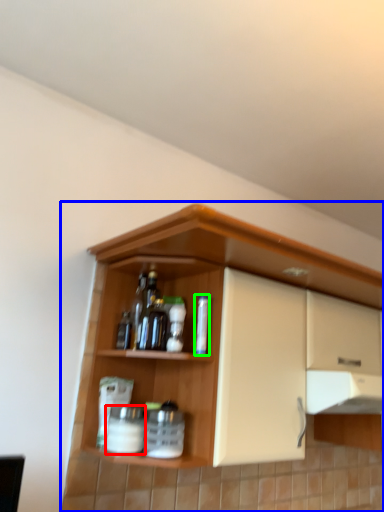
Question: Estimate the real-world distances between objects in this image. Which object is closer to beverage (highlighted by a red box), cupboard (highlighted by a blue box) or bottle (highlighted by a green box)?

Choices:
 (A) cupboard
 (B) bottle

Answer: (B)